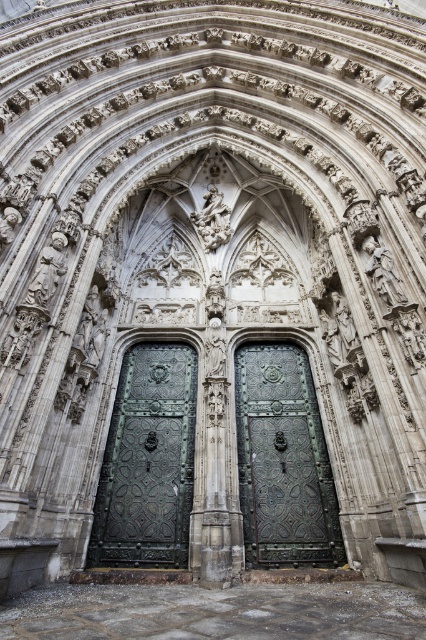
Is bronze textured door at center bigger than bronze ornate door at center?

Correct, bronze textured door at center is larger in size than bronze ornate door at center.

The width and height of the screenshot is (426, 640). What do you see at coordinates (147, 461) in the screenshot? I see `bronze textured door at center` at bounding box center [147, 461].

You are a GUI agent. You are given a task and a screenshot of the screen. Output one action in this format:
    pyautogui.click(x=<x>, y=<y>)
    Task: Click on the bronze textured door at center
    
    Given the screenshot: What is the action you would take?
    [147, 461]